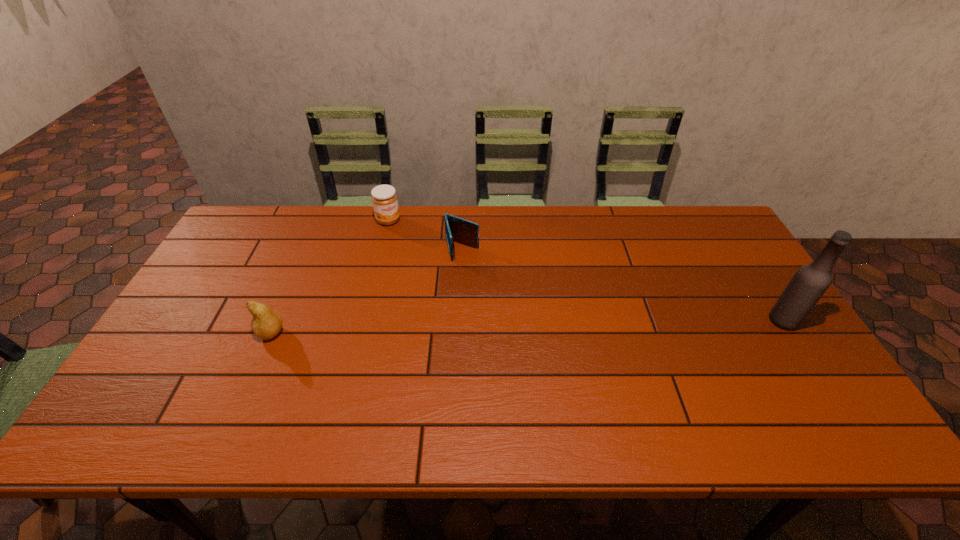
In order to click on the leftmost object in this screenshot , I will do `click(266, 323)`.

Where is `the rightmost object`? the rightmost object is located at coordinates (810, 282).

Image resolution: width=960 pixels, height=540 pixels. Find the location of `the tallest object`. the tallest object is located at coordinates (810, 282).

The height and width of the screenshot is (540, 960). What are the coordinates of `wallet` in the screenshot? It's located at (457, 229).

At what (x,y) coordinates should I click in order to perform the action: click on the second object from right to left. Please return your answer as a coordinate pair (x, y). Looking at the image, I should click on (457, 229).

The image size is (960, 540). In order to click on the farthest object in this screenshot , I will do `click(384, 198)`.

In order to click on the third object from right to left in this screenshot , I will do `click(384, 198)`.

I want to click on free location located on the right of the pear, so click(x=420, y=333).

Image resolution: width=960 pixels, height=540 pixels. Identify the location of vacant space located 0.180m on the exterior surface of the wallet. (476, 303).

This screenshot has height=540, width=960. Identify the location of free space located on the exterior surface of the wallet. (475, 298).